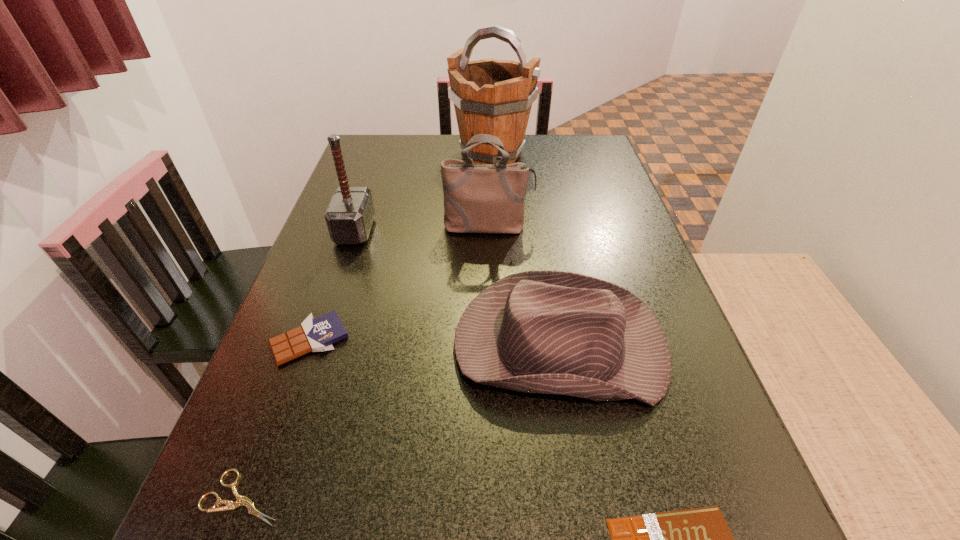
In the image, there is a desktop. At what (x,y) coordinates should I click in order to perform the action: click on blank space at the left edge. Please return your answer as a coordinate pair (x, y). This screenshot has width=960, height=540. Looking at the image, I should click on (362, 278).

Where is `vacant space at the right edge of the desktop`? The height and width of the screenshot is (540, 960). vacant space at the right edge of the desktop is located at coordinates (632, 417).

In the image, there is a desktop. At what (x,y) coordinates should I click in order to perform the action: click on vacant space at the far left corner. Please return your answer as a coordinate pair (x, y). The height and width of the screenshot is (540, 960). Looking at the image, I should click on (392, 157).

The height and width of the screenshot is (540, 960). I want to click on blank space at the far right corner of the desktop, so click(572, 161).

Find the location of a particular element. The image size is (960, 540). vacant region between the shoulder bag and the shears is located at coordinates (366, 362).

The image size is (960, 540). Find the location of `free space between the left chocolate bar and the shoulder bag`. free space between the left chocolate bar and the shoulder bag is located at coordinates [x=399, y=284].

What are the coordinates of `blank region between the hammer and the shears` in the screenshot? It's located at (299, 364).

Find the location of a particular element. The width and height of the screenshot is (960, 540). object that can be found as the second closest to the shears is located at coordinates (550, 332).

The width and height of the screenshot is (960, 540). In order to click on object that is the fourth closest to the shortest object in this screenshot , I will do pyautogui.click(x=478, y=198).

Where is `free region that satisfies the following two spatial constraints: 1. on the back side of the bucket; 2. on the right side of the hammer`? The width and height of the screenshot is (960, 540). free region that satisfies the following two spatial constraints: 1. on the back side of the bucket; 2. on the right side of the hammer is located at coordinates [381, 153].